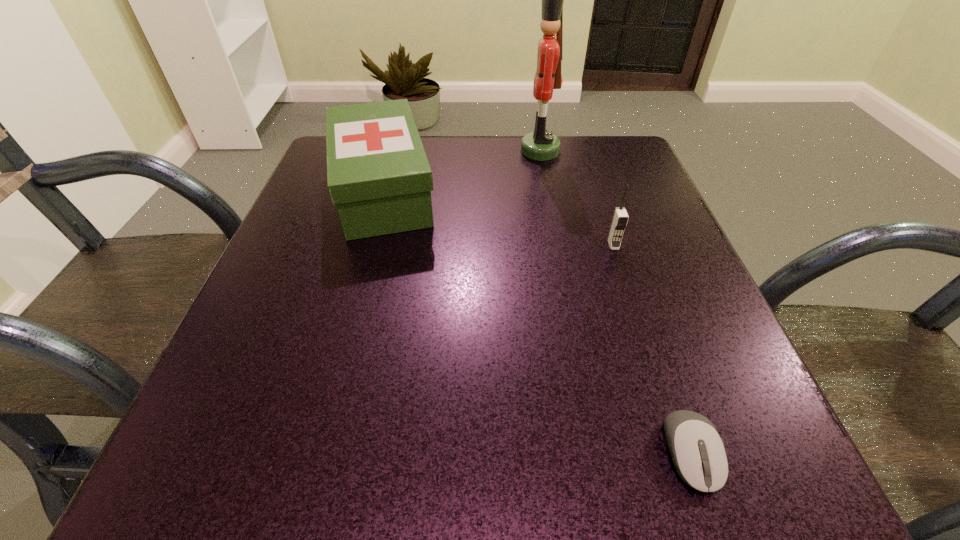
You are a GUI agent. You are given a task and a screenshot of the screen. Output one action in this format:
    pyautogui.click(x=<x>, y=<y>)
    Task: Click on the second object from left to right
    
    Given the screenshot: What is the action you would take?
    pyautogui.click(x=541, y=145)

Find the location of a particular element. the tallest object is located at coordinates (541, 145).

This screenshot has height=540, width=960. I want to click on the first-aid kit, so click(378, 175).

This screenshot has width=960, height=540. I want to click on cellular telephone, so click(620, 218).

At what (x,y) coordinates should I click in order to perform the action: click on the nearest object. Please return your answer as a coordinate pair (x, y). The height and width of the screenshot is (540, 960). Looking at the image, I should click on (698, 453).

Find the location of a particular element. Image resolution: width=960 pixels, height=540 pixels. computer equipment is located at coordinates (698, 453).

The image size is (960, 540). I want to click on free space located on the front-facing side of the nutcracker, so click(x=462, y=151).

Image resolution: width=960 pixels, height=540 pixels. Identify the location of vacant space located 0.360m on the front-facing side of the nutcracker. (371, 151).

I want to click on vacant space located on the front-facing side of the nutcracker, so click(492, 151).

The width and height of the screenshot is (960, 540). I want to click on free point located on the front of the leftmost object, so click(x=344, y=333).